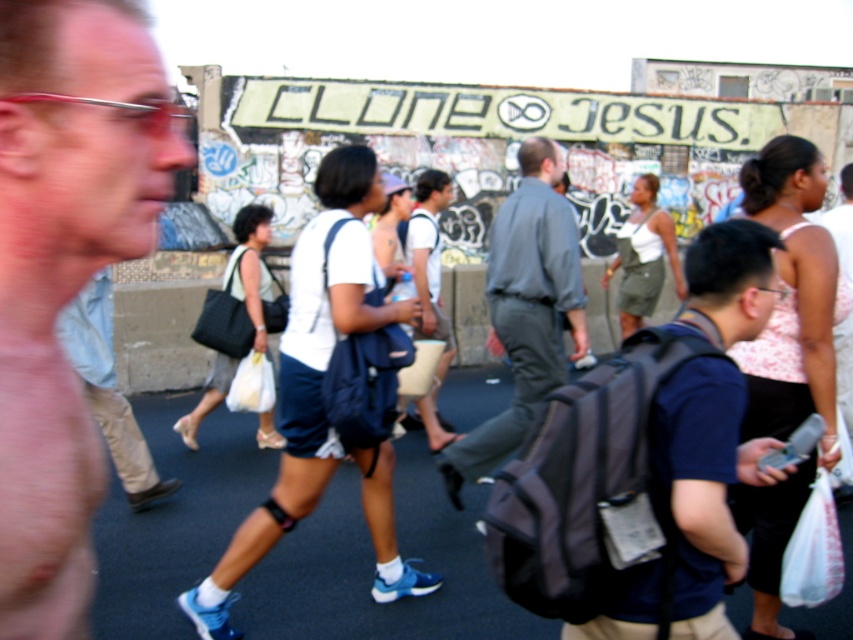
What do you see at coordinates (373, 566) in the screenshot? The width and height of the screenshot is (853, 640). I see `black asphalt at center` at bounding box center [373, 566].

Locate an element on the screen. Image resolution: width=853 pixels, height=640 pixels. black asphalt at center is located at coordinates (373, 566).

Is point (134, 625) farther from viewer compared to point (84, 365)?

No.

Where is `black asphalt at center`? The height and width of the screenshot is (640, 853). black asphalt at center is located at coordinates (373, 566).

Between matte blue shorts at center and light blue denim jeans at center, which one has more height?

light blue denim jeans at center is taller.

Is point (7, 141) positioned before point (82, 300)?

That is True.

Locate an element on the screen. matte blue shorts at center is located at coordinates [x=65, y=273].

Who is lower down, matte blue shorts at center or black asphalt at center?

black asphalt at center is lower down.

Is matte blue shorts at center behind black asphalt at center?

No.

You are a GUI agent. You are given a task and a screenshot of the screen. Output one action in this format:
    pyautogui.click(x=<x>, y=<y>)
    Task: Click on the matte blue shorts at center
    
    Given the screenshot: What is the action you would take?
    pyautogui.click(x=65, y=273)

The image size is (853, 640). I want to click on matte blue shorts at center, so click(x=65, y=273).